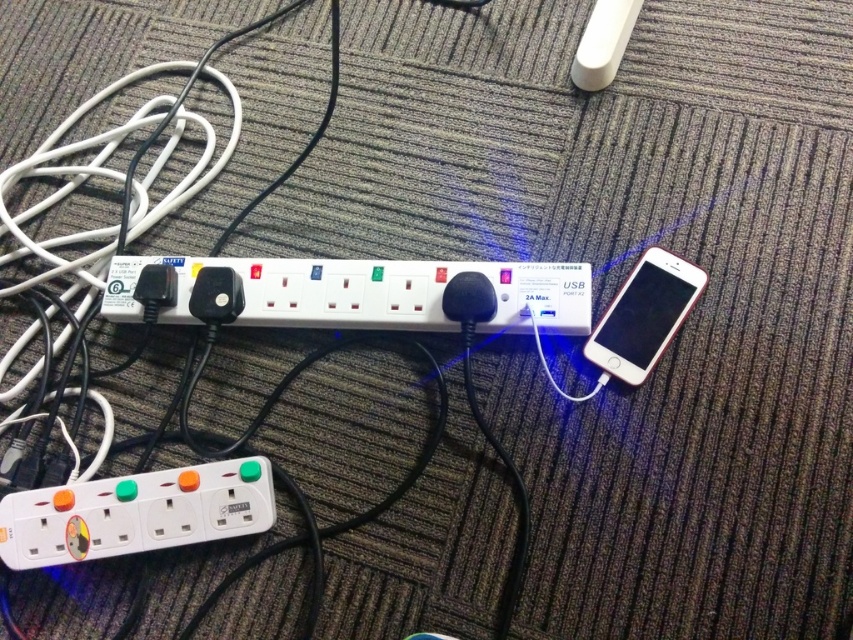
You are a delivery robot with a 10 inch wide package. You need to navigate through the space between the white plastic power strip at center and the white glossy smartphone at right. Can your package fit through that space?

The distance between the white plastic power strip at center and the white glossy smartphone at right is 9.64 inches. Since the package is 10 inches wide, it cannot fit through the space as it is slightly wider than the available gap.

You are setting up a charging station and need to place two power strips on a shelf. The shelf has limited space. You have the white plastic power strip at center and the white plastic power strip at lower left. Which one should you choose to fit better in the smaller space?

The white plastic power strip at center is shorter than the white plastic power strip at lower left, so the white plastic power strip at center would fit better in the smaller space.

You are setting up a charging station and need to place the white plastic power strip at lower left and the white glossy smartphone at right on a shelf. The shelf has a height limit of 10 cm. Can both items fit vertically without exceeding the height limit?

The white plastic power strip at lower left is not as tall as the white glossy smartphone at right. Since the smartphone is taller, it will determine the maximum height needed. If the smartphone exceeds 10 cm, both cannot fit. However, if the smartphone is under 10 cm, both can fit. Without exact measurements, we can only say the power strip is shorter, but cannot confirm total height.